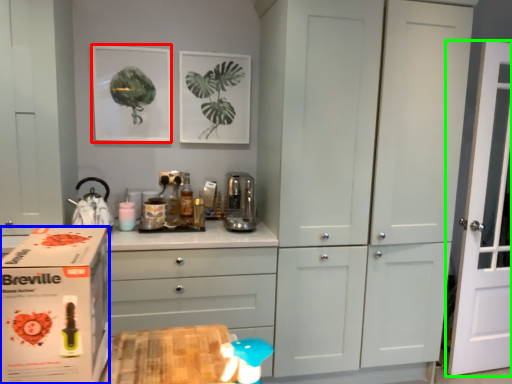
Question: Based on their relative distances, which object is farther from picture frame (highlighted by a red box)? Choose from cardboard box (highlighted by a blue box) and door (highlighted by a green box).

Choices:
 (A) cardboard box
 (B) door

Answer: (B)